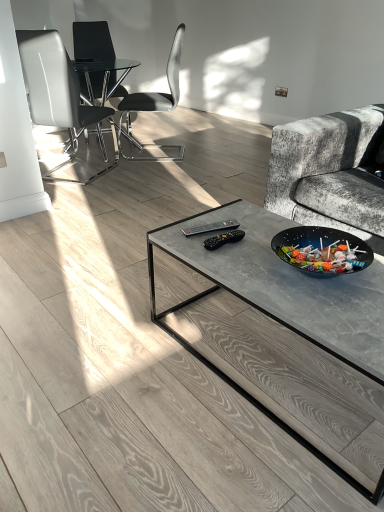
Find the location of a particular element. The height and width of the screenshot is (512, 384). blank area beneath white leather chair at left, acting as the first chair starting from the front (from a real-world perspective) is located at coordinates (78, 169).